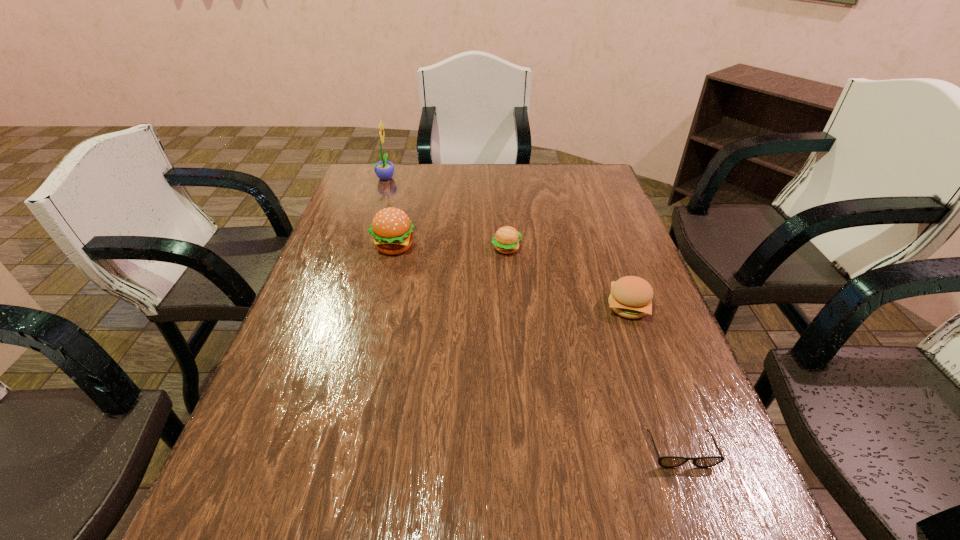
Image resolution: width=960 pixels, height=540 pixels. I want to click on vacant space that satisfies the following two spatial constraints: 1. on the front-facing side of the farthest object; 2. on the back side of the tallest hamburger, so click(x=363, y=246).

This screenshot has height=540, width=960. I want to click on vacant area that satisfies the following two spatial constraints: 1. on the front-facing side of the second hamburger from right to left; 2. on the right side of the tallest object, so coord(363,248).

At what (x,y) coordinates should I click in order to perform the action: click on vacant space that satisfies the following two spatial constraints: 1. on the front-facing side of the second tallest hamburger; 2. on the right side of the tallest object. Please return your answer as a coordinate pair (x, y). The width and height of the screenshot is (960, 540). Looking at the image, I should click on (344, 307).